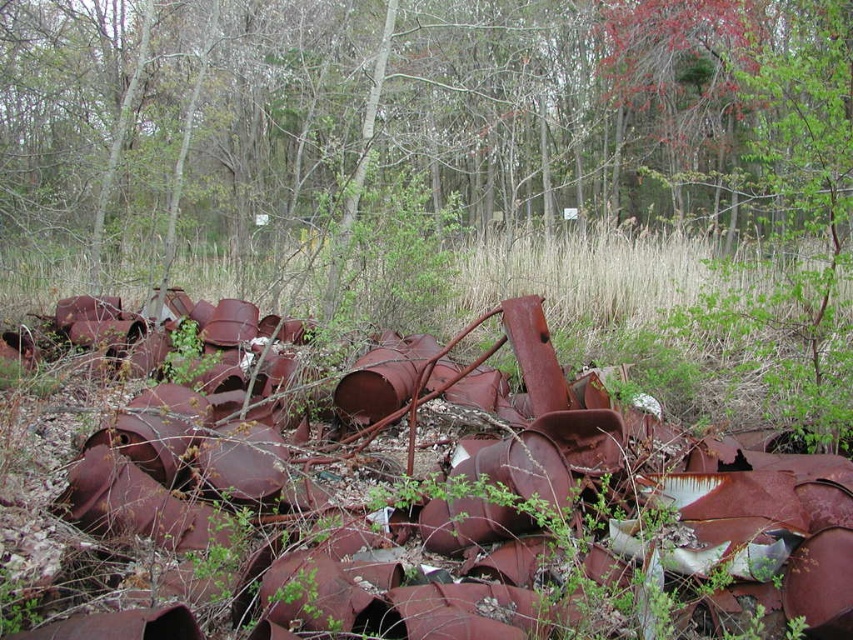
In the scene shown: Is rusty metal pipes at center further to the viewer compared to brown dry grass at center?

No, rusty metal pipes at center is in front of brown dry grass at center.

Does point (759, 529) come farther from viewer compared to point (758, 356)?

No, it is in front of (758, 356).

Find the location of a particular element. This screenshot has height=640, width=853. rusty metal pipes at center is located at coordinates (457, 497).